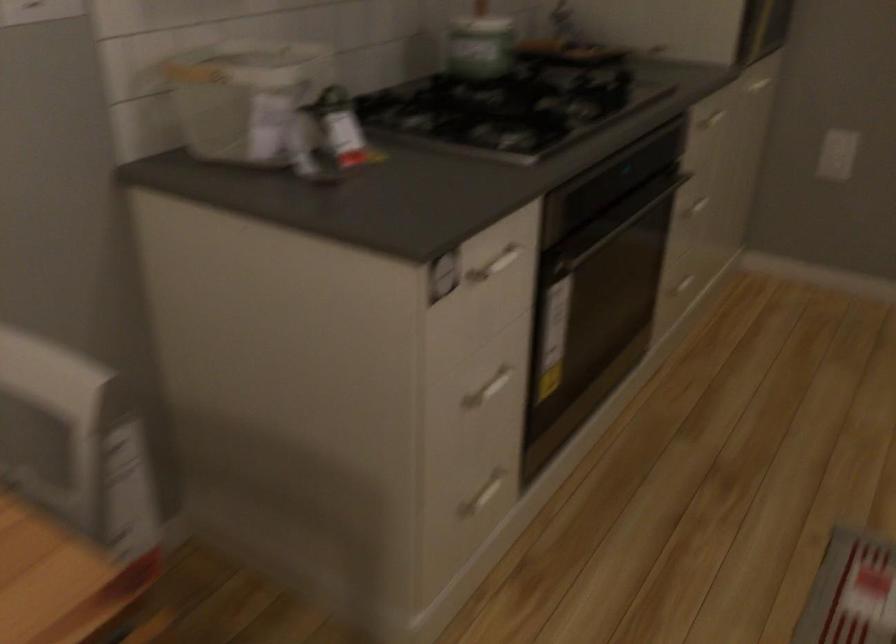
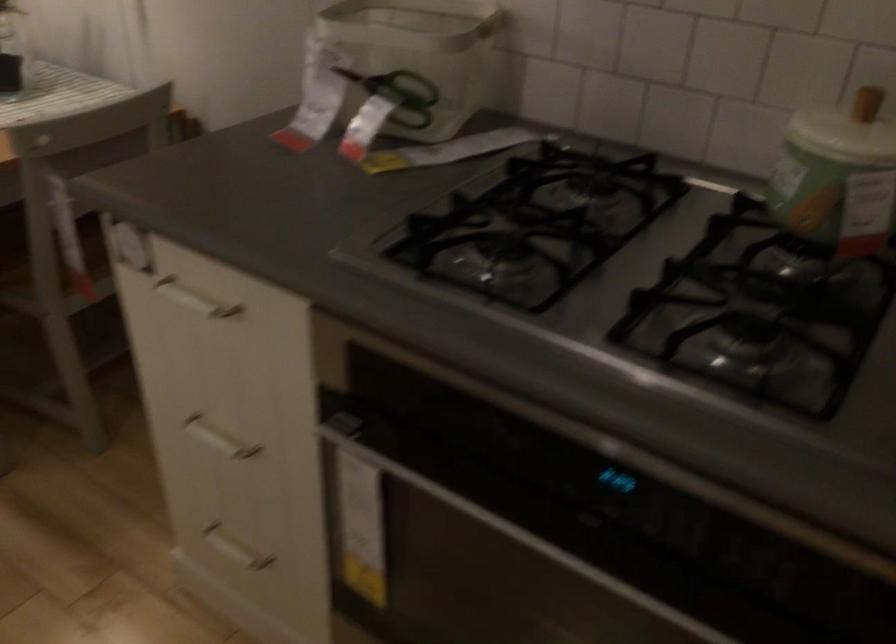
Find the pixel in the second image that matches (468,287) in the first image.

(194, 299)